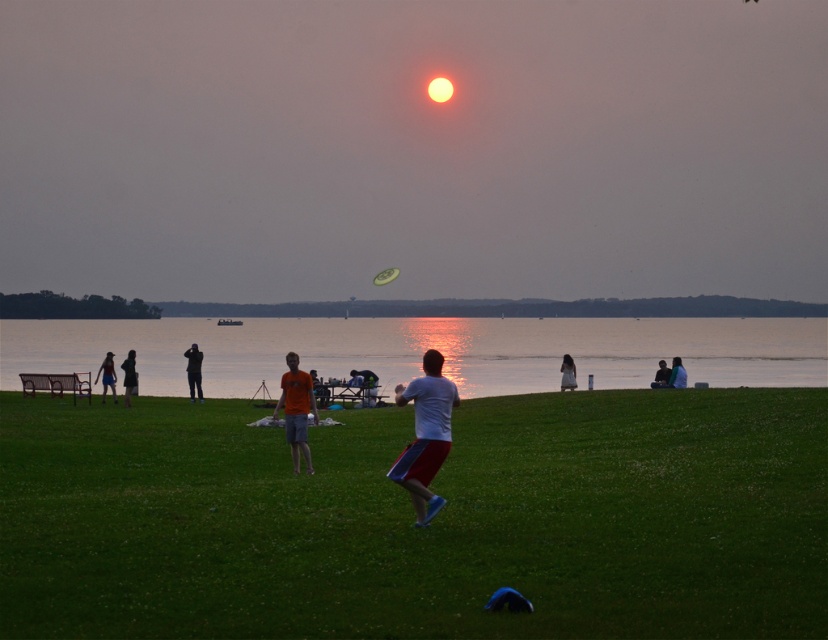
Question: From the image, what is the correct spatial relationship of white matte shirt at center in relation to orange t-shirt at center?

Choices:
 (A) left
 (B) right

Answer: (B)

Question: Which of the following is the farthest from the observer?

Choices:
 (A) (112, 355)
 (B) (453, 401)
 (C) (562, 372)

Answer: (A)

Question: Which is nearer to the orange cotton t-shirt at center?

Choices:
 (A) green grass at center
 (B) orange t-shirt at center
 (C) smooth skin person at center

Answer: (A)

Question: Can you confirm if white matte shirt at center is bigger than orange t-shirt at center?

Choices:
 (A) no
 (B) yes

Answer: (A)

Question: Which object is the farthest from the orange cotton t-shirt at center?

Choices:
 (A) dark blue jeans at lower left
 (B) smooth skin person at center
 (C) silhouette fabric person at center

Answer: (C)

Question: Is reflective silver water at center positioned in front of dark blue jeans at lower left?

Choices:
 (A) no
 (B) yes

Answer: (B)